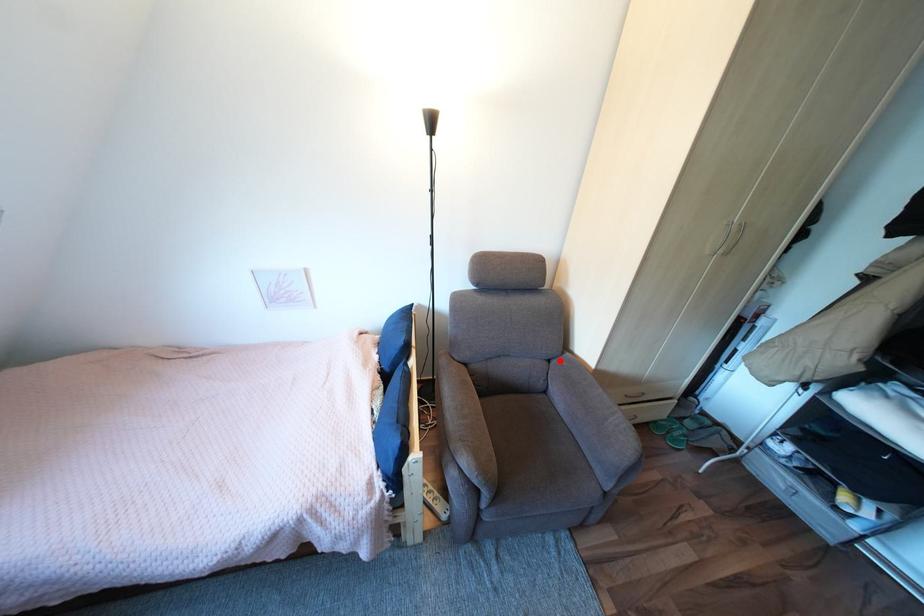
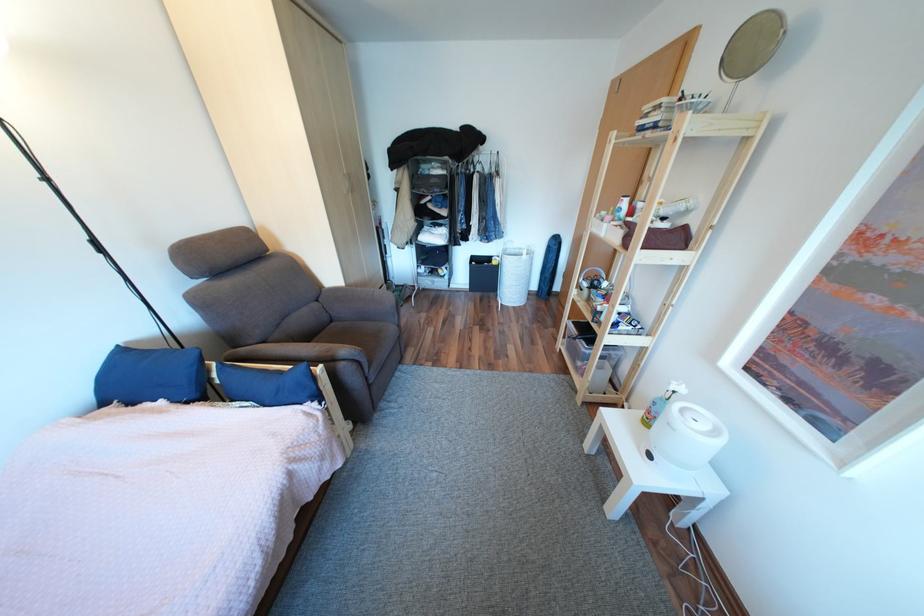
Find the pixel in the second image that matches the highlighted location in the first image.

(329, 301)